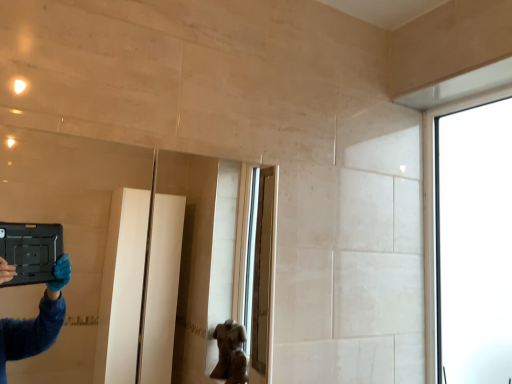
Question: Is clear glass mirror at upper left far away from transparent glass window at upper right?

Choices:
 (A) no
 (B) yes

Answer: (B)

Question: Is clear glass mirror at upper left facing towards transparent glass window at upper right?

Choices:
 (A) no
 (B) yes

Answer: (A)

Question: From the image's perspective, does clear glass mirror at upper left appear higher than transparent glass window at upper right?

Choices:
 (A) no
 (B) yes

Answer: (A)

Question: Does clear glass mirror at upper left have a lesser width compared to transparent glass window at upper right?

Choices:
 (A) no
 (B) yes

Answer: (A)

Question: Does clear glass mirror at upper left have a larger size compared to transparent glass window at upper right?

Choices:
 (A) no
 (B) yes

Answer: (B)

Question: Can you confirm if clear glass mirror at upper left is taller than transparent glass window at upper right?

Choices:
 (A) no
 (B) yes

Answer: (A)

Question: Considering the relative positions of transparent glass window at upper right and clear glass mirror at upper left in the image provided, is transparent glass window at upper right to the right of clear glass mirror at upper left from the viewer's perspective?

Choices:
 (A) no
 (B) yes

Answer: (B)

Question: From the image's perspective, is transparent glass window at upper right on top of clear glass mirror at upper left?

Choices:
 (A) yes
 (B) no

Answer: (A)

Question: Is transparent glass window at upper right not inside clear glass mirror at upper left?

Choices:
 (A) no
 (B) yes

Answer: (B)

Question: Is transparent glass window at upper right thinner than clear glass mirror at upper left?

Choices:
 (A) no
 (B) yes

Answer: (B)

Question: From a real-world perspective, is transparent glass window at upper right located beneath clear glass mirror at upper left?

Choices:
 (A) yes
 (B) no

Answer: (B)

Question: Is clear glass mirror at upper left inside transparent glass window at upper right?

Choices:
 (A) no
 (B) yes

Answer: (A)

Question: Is transparent glass window at upper right inside the boundaries of clear glass mirror at upper left, or outside?

Choices:
 (A) inside
 (B) outside

Answer: (B)